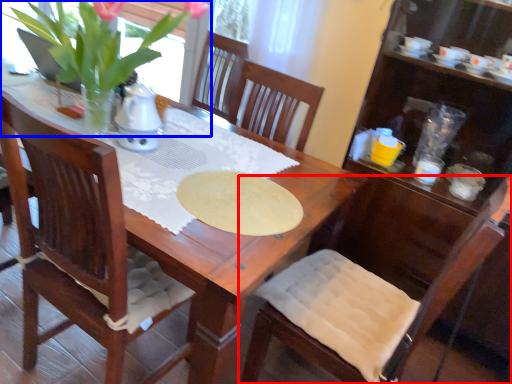
Question: Which point is further to the camera, chair (highlighted by a red box) or houseplant (highlighted by a blue box)?

Choices:
 (A) chair
 (B) houseplant

Answer: (B)